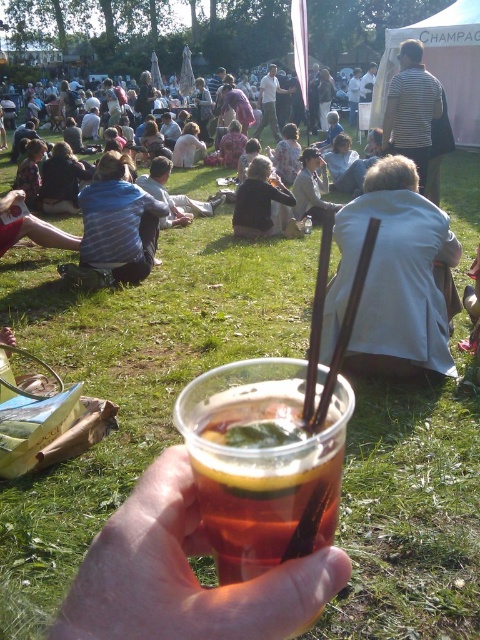
Question: Is translucent plastic cup at lower center closer to camera compared to blue striped shirt at center?

Choices:
 (A) no
 (B) yes

Answer: (B)

Question: Which of the following is the closest to the observer?

Choices:
 (A) (264, 163)
 (B) (269, 97)
 (C) (382, 186)
 (D) (103, 170)

Answer: (C)

Question: Is translucent plastic cup at center wider than striped fabric shirt at upper center?

Choices:
 (A) no
 (B) yes

Answer: (A)

Question: Is white fabric jacket at center wider than striped fabric shirt at upper center?

Choices:
 (A) yes
 (B) no

Answer: (A)

Question: Which point is closer to the camera?

Choices:
 (A) blue striped shirt at center
 (B) translucent plastic cup at center

Answer: (B)

Question: Which of the following is the closest to the observer?

Choices:
 (A) white fabric jacket at center
 (B) light beige cotton shirt at center
 (C) blue striped shirt at center
 (D) dark gray sweater at center

Answer: (A)